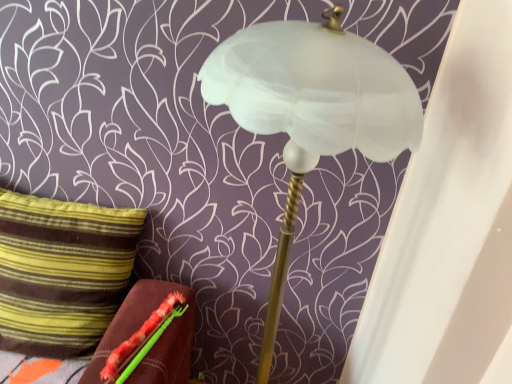
Describe the element at coordinates (311, 110) in the screenshot. The width and height of the screenshot is (512, 384). I see `white frosted glass lamp at center` at that location.

At what (x,y) coordinates should I click in order to perform the action: click on white frosted glass lamp at center. Please return your answer as a coordinate pair (x, y). Image resolution: width=512 pixels, height=384 pixels. Looking at the image, I should click on (311, 110).

Between green fuzzy brush at lower left and white frosted glass lamp at center, which one appears on the left side from the viewer's perspective?

From the viewer's perspective, green fuzzy brush at lower left appears more on the left side.

From a real-world perspective, which object stands above the other?

white frosted glass lamp at center is physically above.

Would you say green fuzzy brush at lower left is inside or outside white frosted glass lamp at center?

The correct answer is: outside.

Does point (2, 258) come farther from viewer compared to point (277, 40)?

Yes, point (2, 258) is behind point (277, 40).

Could you tell me if striped fabric pillow at left is turned towards white frosted glass lamp at center?

No, striped fabric pillow at left is not turned towards white frosted glass lamp at center.

Considering the positions of points (127, 276) and (161, 328), is point (127, 276) closer to camera compared to point (161, 328)?

No, it is behind (161, 328).

I want to click on pillow above the green fuzzy brush at lower left (from the image's perspective), so (x=62, y=272).

Is striped fabric pillow at left turned away from green fuzzy brush at lower left?

striped fabric pillow at left is not turned away from green fuzzy brush at lower left.

In the scene shown: From a real-world perspective, who is located higher, striped fabric pillow at left or green fuzzy brush at lower left?

From a 3D spatial view, striped fabric pillow at left is above.

Which object is positioned more to the left, white frosted glass lamp at center or green fuzzy brush at lower left?

From the viewer's perspective, green fuzzy brush at lower left appears more on the left side.

Is green fuzzy brush at lower left located within white frosted glass lamp at center?

No, white frosted glass lamp at center does not contain green fuzzy brush at lower left.

From a real-world perspective, which object rests below the other?

green fuzzy brush at lower left, from a real-world perspective.

Which object is further away from the camera taking this photo, white frosted glass lamp at center or green fuzzy brush at lower left?

green fuzzy brush at lower left is more distant.

From the image's perspective, which is below, white frosted glass lamp at center or striped fabric pillow at left?

white frosted glass lamp at center, from the image's perspective.

Which object is thinner, white frosted glass lamp at center or striped fabric pillow at left?

Thinner between the two is striped fabric pillow at left.

At what (x,y) coordinates should I click in order to perform the action: click on pillow beneath the white frosted glass lamp at center (from a real-world perspective). Please return your answer as a coordinate pair (x, y). The width and height of the screenshot is (512, 384). Looking at the image, I should click on (62, 272).

Is white frosted glass lamp at center touching striped fabric pillow at left?

No, white frosted glass lamp at center is not beside striped fabric pillow at left.

Would you consider green fuzzy brush at lower left to be distant from striped fabric pillow at left?

green fuzzy brush at lower left is actually quite close to striped fabric pillow at left.

Considering the relative positions of green fuzzy brush at lower left and striped fabric pillow at left in the image provided, is green fuzzy brush at lower left to the right of striped fabric pillow at left from the viewer's perspective?

Indeed, green fuzzy brush at lower left is positioned on the right side of striped fabric pillow at left.

In the scene shown: Is green fuzzy brush at lower left taller than striped fabric pillow at left?

Incorrect, the height of green fuzzy brush at lower left is not larger of that of striped fabric pillow at left.

Can striped fabric pillow at left be found inside green fuzzy brush at lower left?

No, striped fabric pillow at left is not surrounded by green fuzzy brush at lower left.

You are a GUI agent. You are given a task and a screenshot of the screen. Output one action in this format:
    pyautogui.click(x=<x>, y=<y>)
    Task: Click on the lamp in front of the green fuzzy brush at lower left
    This screenshot has height=384, width=512.
    Given the screenshot: What is the action you would take?
    pyautogui.click(x=311, y=110)

In the image, there is a white frosted glass lamp at center. What are the coordinates of `pillow below it (from a real-world perspective)` in the screenshot? It's located at (62, 272).

When comparing their distances from striped fabric pillow at left, does green fuzzy brush at lower left or white frosted glass lamp at center seem closer?

green fuzzy brush at lower left is positioned closer to the anchor striped fabric pillow at left.

Which object lies nearer to the anchor point green fuzzy brush at lower left, white frosted glass lamp at center or striped fabric pillow at left?

striped fabric pillow at left is closer to green fuzzy brush at lower left.

Which object lies nearer to the anchor point white frosted glass lamp at center, green fuzzy brush at lower left or striped fabric pillow at left?

green fuzzy brush at lower left lies closer to white frosted glass lamp at center than the other object.

From the image, which object appears to be farther from striped fabric pillow at left, white frosted glass lamp at center or green fuzzy brush at lower left?

white frosted glass lamp at center lies further to striped fabric pillow at left than the other object.

Looking at the image, which one is located closer to white frosted glass lamp at center, striped fabric pillow at left or green fuzzy brush at lower left?

green fuzzy brush at lower left lies closer to white frosted glass lamp at center than the other object.

From the image, which object appears to be farther from green fuzzy brush at lower left, striped fabric pillow at left or white frosted glass lamp at center?

Based on the image, white frosted glass lamp at center appears to be further to green fuzzy brush at lower left.

At what (x,y) coordinates should I click in order to perform the action: click on flower between striped fabric pillow at left and white frosted glass lamp at center in the horizontal direction. Please return your answer as a coordinate pair (x, y). The width and height of the screenshot is (512, 384). Looking at the image, I should click on (142, 340).